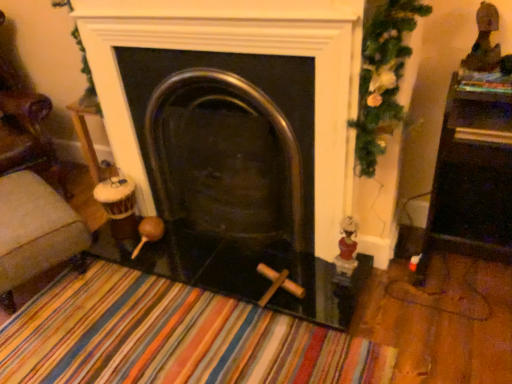
What do you see at coordinates (347, 247) in the screenshot?
I see `white porcelain figurine at right, acting as the first toy starting from the bottom` at bounding box center [347, 247].

Where is `velvet beige ottoman at left`? The height and width of the screenshot is (384, 512). velvet beige ottoman at left is located at coordinates (35, 229).

Where is `white porcelain figurine at right, which appears as the second toy when viewed from the top`? Image resolution: width=512 pixels, height=384 pixels. white porcelain figurine at right, which appears as the second toy when viewed from the top is located at coordinates (347, 247).

Does velvet beige ottoman at left have a lesser width compared to polished metal fireplace at center?

Incorrect, the width of velvet beige ottoman at left is not less than that of polished metal fireplace at center.

Where is `fireplace above the velvet beige ottoman at left (from the image's perspective)`? The height and width of the screenshot is (384, 512). fireplace above the velvet beige ottoman at left (from the image's perspective) is located at coordinates (226, 138).

Who is shorter, velvet beige ottoman at left or polished metal fireplace at center?

velvet beige ottoman at left.

From the image's perspective, is white porcelain figurine at right, which appears as the second toy when viewed from the top, below velvet beige ottoman at left?

Yes.

Identify the location of furniture on the left side of white porcelain figurine at right, the second toy from the right. (35, 229).

Is white porcelain figurine at right, the first toy in the left-to-right sequence, inside or outside of velvet beige ottoman at left?

white porcelain figurine at right, the first toy in the left-to-right sequence, exists outside the volume of velvet beige ottoman at left.

Does point (343, 227) come closer to viewer compared to point (65, 226)?

Yes, it is in front of point (65, 226).

Considering the sizes of polished metal fireplace at center and velvet beige ottoman at left in the image, is polished metal fireplace at center wider or thinner than velvet beige ottoman at left?

Considering their sizes, polished metal fireplace at center looks slimmer than velvet beige ottoman at left.

Is polished metal fireplace at center far away from velvet beige ottoman at left?

polished metal fireplace at center is actually quite close to velvet beige ottoman at left.

How different are the orientations of polished metal fireplace at center and velvet beige ottoman at left in degrees?

There is a 68.6-degree angle between the facing directions of polished metal fireplace at center and velvet beige ottoman at left.

Between polished metal fireplace at center and velvet beige ottoman at left, which one has smaller size?

With smaller size is velvet beige ottoman at left.

Is velvet beige ottoman at left touching shiny dark brown statue at upper right, which is counted as the 1th toy, starting from the top?

Answer: No, velvet beige ottoman at left is not making contact with shiny dark brown statue at upper right, which is counted as the 1th toy, starting from the top.

Is velvet beige ottoman at left taller or shorter than shiny dark brown statue at upper right, which is counted as the 1th toy, starting from the top?

velvet beige ottoman at left is taller than shiny dark brown statue at upper right, which is counted as the 1th toy, starting from the top.

Which is correct: velvet beige ottoman at left is inside shiny dark brown statue at upper right, which is the first toy in right-to-left order, or outside of it?

The correct answer is: outside.

Considering the relative sizes of velvet beige ottoman at left and shiny dark brown statue at upper right, which is the first toy in right-to-left order, in the image provided, is velvet beige ottoman at left thinner than shiny dark brown statue at upper right, which is the first toy in right-to-left order,?

No, velvet beige ottoman at left is not thinner than shiny dark brown statue at upper right, which is the first toy in right-to-left order.

Do you think shiny dark brown statue at upper right, arranged as the second toy when ordered from the bottom, is within white porcelain figurine at right, the first toy in the left-to-right sequence, or outside of it?

shiny dark brown statue at upper right, arranged as the second toy when ordered from the bottom, is located beyond the bounds of white porcelain figurine at right, the first toy in the left-to-right sequence.

Considering the points (466, 66) and (346, 228), which point is behind, point (466, 66) or point (346, 228)?

Positioned behind is point (346, 228).

Does shiny dark brown statue at upper right, which is counted as the 1th toy, starting from the top, appear on the left side of white porcelain figurine at right, which appears as the second toy when viewed from the top?

No, shiny dark brown statue at upper right, which is counted as the 1th toy, starting from the top, is not to the left of white porcelain figurine at right, which appears as the second toy when viewed from the top.

Is shiny dark brown statue at upper right, which is counted as the 1th toy, starting from the top, far away from white porcelain figurine at right, the second toy from the right?

No, there isn't a large distance between shiny dark brown statue at upper right, which is counted as the 1th toy, starting from the top, and white porcelain figurine at right, the second toy from the right.

In the image, is shiny dark brown statue at upper right, which is counted as the 1th toy, starting from the top, on the left side or the right side of polished metal fireplace at center?

Clearly, shiny dark brown statue at upper right, which is counted as the 1th toy, starting from the top, is on the right of polished metal fireplace at center in the image.

Which is in front, shiny dark brown statue at upper right, arranged as the second toy when ordered from the bottom, or polished metal fireplace at center?

shiny dark brown statue at upper right, arranged as the second toy when ordered from the bottom.

You are a GUI agent. You are given a task and a screenshot of the screen. Output one action in this format:
    pyautogui.click(x=<x>, y=<y>)
    Task: Click on the toy above the polished metal fireplace at center (from a real-world perspective)
    This screenshot has height=384, width=512.
    Given the screenshot: What is the action you would take?
    pyautogui.click(x=484, y=42)

Considering the positions of points (465, 57) and (222, 70), is point (465, 57) farther from camera compared to point (222, 70)?

No, (465, 57) is closer to viewer.

Considering the relative sizes of shiny dark brown statue at upper right, arranged as the second toy when ordered from the bottom, and green textured garland at upper right in the image provided, is shiny dark brown statue at upper right, arranged as the second toy when ordered from the bottom, smaller than green textured garland at upper right?

Correct, shiny dark brown statue at upper right, arranged as the second toy when ordered from the bottom, occupies less space than green textured garland at upper right.

From the image's perspective, is shiny dark brown statue at upper right, which is counted as the 1th toy, starting from the top, on top of green textured garland at upper right?

Yes, from the image's perspective, shiny dark brown statue at upper right, which is counted as the 1th toy, starting from the top, is above green textured garland at upper right.

Looking at this image, from a real-world perspective, is shiny dark brown statue at upper right, which is counted as the 1th toy, starting from the top, beneath green textured garland at upper right?

No, from a real-world perspective, shiny dark brown statue at upper right, which is counted as the 1th toy, starting from the top, is not below green textured garland at upper right.

Could you tell me if shiny dark brown statue at upper right, which is the 2th toy from left to right, is turned towards green textured garland at upper right?

No, shiny dark brown statue at upper right, which is the 2th toy from left to right, is not facing towards green textured garland at upper right.

What are the coordinates of `fireplace on the right of the velvet beige ottoman at left` in the screenshot? It's located at (226, 138).

You are a GUI agent. You are given a task and a screenshot of the screen. Output one action in this format:
    pyautogui.click(x=<x>, y=<y>)
    Task: Click on the furniture lying on the left of white porcelain figurine at right, acting as the first toy starting from the bottom
    The height and width of the screenshot is (384, 512).
    Given the screenshot: What is the action you would take?
    pyautogui.click(x=35, y=229)

Estimate the real-world distances between objects in this image. Which object is closer to shiny dark brown statue at upper right, which is the 2th toy from left to right, white porcelain figurine at right, acting as the first toy starting from the bottom, or velvet beige ottoman at left?

Among the two, white porcelain figurine at right, acting as the first toy starting from the bottom, is located nearer to shiny dark brown statue at upper right, which is the 2th toy from left to right.

Estimate the real-world distances between objects in this image. Which object is closer to shiny dark brown statue at upper right, which is counted as the 1th toy, starting from the top, green textured garland at upper right or velvet beige ottoman at left?

green textured garland at upper right lies closer to shiny dark brown statue at upper right, which is counted as the 1th toy, starting from the top, than the other object.

Estimate the real-world distances between objects in this image. Which object is further from polished metal fireplace at center, white porcelain figurine at right, which appears as the second toy when viewed from the top, or shiny dark brown statue at upper right, arranged as the second toy when ordered from the bottom?

Based on the image, shiny dark brown statue at upper right, arranged as the second toy when ordered from the bottom, appears to be further to polished metal fireplace at center.

Looking at the image, which one is located further to velvet beige ottoman at left, green textured garland at upper right or polished metal fireplace at center?

green textured garland at upper right is further to velvet beige ottoman at left.

Which object lies further to the anchor point white porcelain figurine at right, acting as the first toy starting from the bottom, green textured garland at upper right or polished metal fireplace at center?

polished metal fireplace at center.

When comparing their distances from velvet beige ottoman at left, does shiny dark brown statue at upper right, arranged as the second toy when ordered from the bottom, or white porcelain figurine at right, which appears as the second toy when viewed from the top, seem further?

shiny dark brown statue at upper right, arranged as the second toy when ordered from the bottom, is positioned further to the anchor velvet beige ottoman at left.

Estimate the real-world distances between objects in this image. Which object is further from green textured garland at upper right, shiny dark brown statue at upper right, which is counted as the 1th toy, starting from the top, or polished metal fireplace at center?

polished metal fireplace at center lies further to green textured garland at upper right than the other object.

When comparing their distances from polished metal fireplace at center, does shiny dark brown statue at upper right, which is the 2th toy from left to right, or velvet beige ottoman at left seem closer?

The object closer to polished metal fireplace at center is velvet beige ottoman at left.

You are a GUI agent. You are given a task and a screenshot of the screen. Output one action in this format:
    pyautogui.click(x=<x>, y=<y>)
    Task: Click on the christmas decoration between shiny dark brown statue at upper right, arranged as the second toy when ordered from the bottom, and white porcelain figurine at right, the second toy from the right, in the up-down direction
    The width and height of the screenshot is (512, 384).
    Given the screenshot: What is the action you would take?
    point(382,75)

This screenshot has width=512, height=384. Find the location of `fireplace located between velvet beige ottoman at left and green textured garland at upper right in the left-right direction`. fireplace located between velvet beige ottoman at left and green textured garland at upper right in the left-right direction is located at coordinates (226, 138).

Image resolution: width=512 pixels, height=384 pixels. I want to click on toy between velvet beige ottoman at left and green textured garland at upper right from left to right, so click(347, 247).

Find the location of a particular element. christmas decoration between velvet beige ottoman at left and shiny dark brown statue at upper right, which is the 2th toy from left to right is located at coordinates (382, 75).